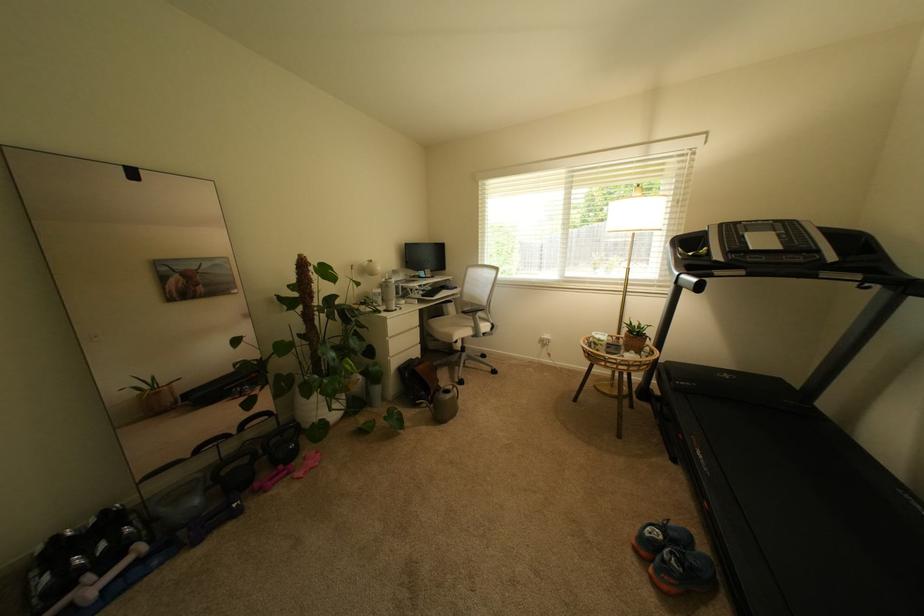
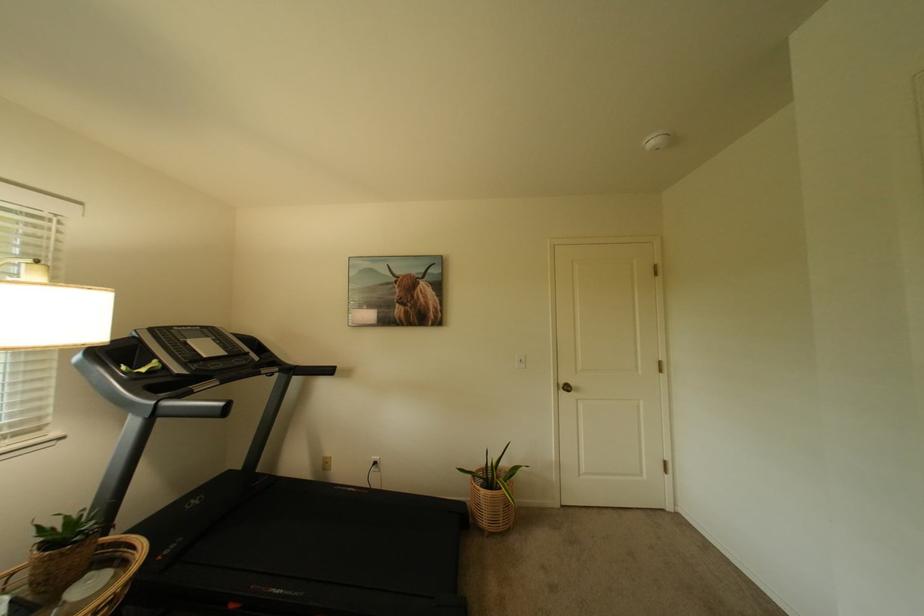
The point at (631, 357) is marked in the first image. Where is the corresponding point in the second image?

(73, 605)